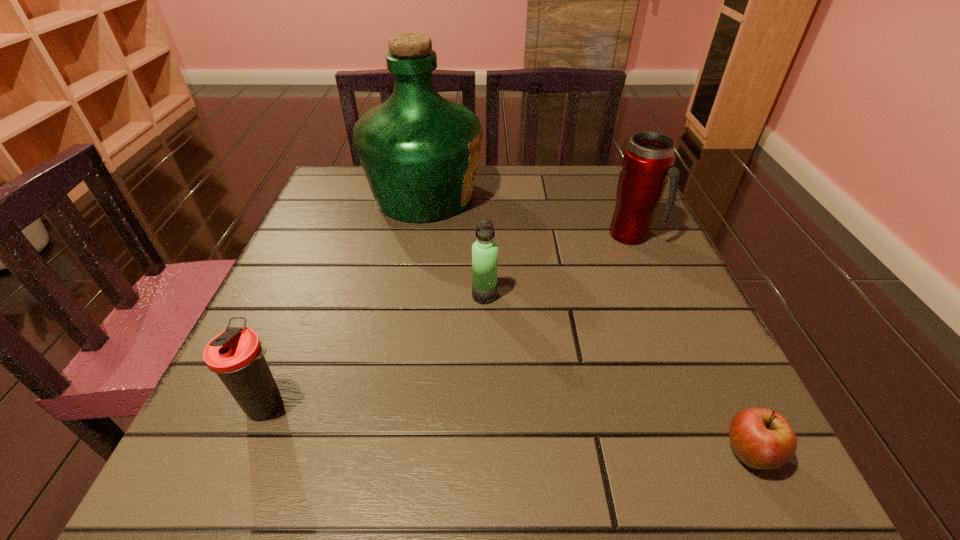
I want to click on vacant region between the third farthest object and the leftmost thermos bottle, so click(x=376, y=350).

The height and width of the screenshot is (540, 960). In order to click on vacant point located between the apple and the liquor in this screenshot , I will do `click(587, 325)`.

Locate an element on the screen. empty location between the rightmost thermos bottle and the nearest object is located at coordinates [689, 345].

Where is `vacant area between the second thermos bottle from left to right and the farthest thermos bottle`? The image size is (960, 540). vacant area between the second thermos bottle from left to right and the farthest thermos bottle is located at coordinates (558, 265).

You are a GUI agent. You are given a task and a screenshot of the screen. Output one action in this format:
    pyautogui.click(x=<x>, y=<y>)
    Task: Click on the unoccupied position between the fourth shortest object and the apple
    The width and height of the screenshot is (960, 540).
    Given the screenshot: What is the action you would take?
    pyautogui.click(x=689, y=345)

The width and height of the screenshot is (960, 540). Identify the location of vacant area that lies between the second tallest object and the liquor. (528, 215).

At what (x,y) coordinates should I click in order to perform the action: click on object that is the third nearest to the shortest object. Please return your answer as a coordinate pair (x, y). Looking at the image, I should click on (419, 151).

You are a GUI agent. You are given a task and a screenshot of the screen. Output one action in this format:
    pyautogui.click(x=<x>, y=<y>)
    Task: Click on the object that is the fourth closest to the tallest thermos bottle
    The height and width of the screenshot is (540, 960).
    Given the screenshot: What is the action you would take?
    pyautogui.click(x=236, y=355)

The image size is (960, 540). I want to click on thermos bottle that is the closest one to the fourth farthest object, so click(484, 251).

Locate an element on the screen. The height and width of the screenshot is (540, 960). the second closest thermos bottle to the rightmost thermos bottle is located at coordinates (236, 355).